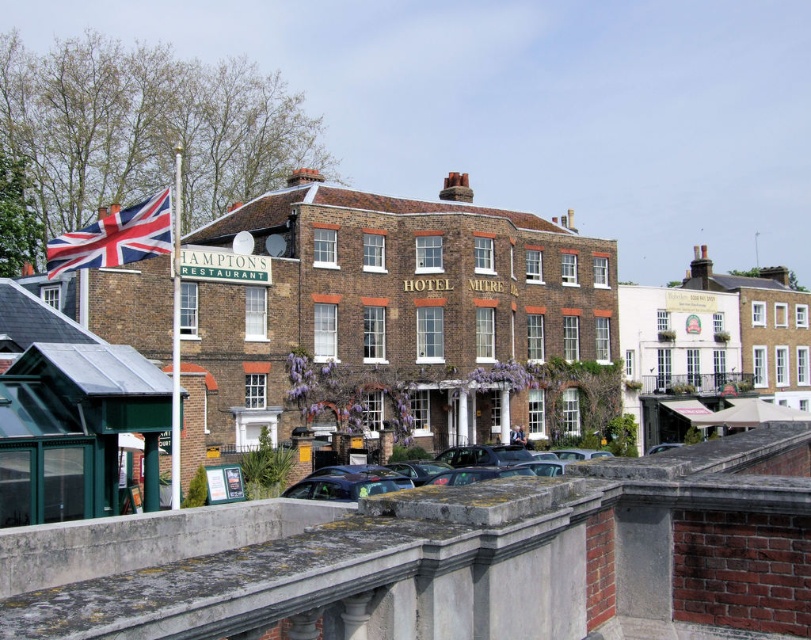
Question: Which object appears farthest from the camera in this image?

Choices:
 (A) union jack fabric at upper left
 (B) white painted building at upper right
 (C) metallic gray car at center
 (D) white brick building at upper right

Answer: (D)

Question: Which of the following is the farthest from the observer?

Choices:
 (A) metallic gray car at center
 (B) white brick building at upper right
 (C) white painted building at upper right

Answer: (B)

Question: Estimate the real-world distances between objects in this image. Which object is farther from the white painted building at upper right?

Choices:
 (A) metallic gray car at center
 (B) union jack fabric at upper left
 (C) white brick building at upper right

Answer: (B)

Question: Does white painted building at upper right appear under metallic gray car at center?

Choices:
 (A) no
 (B) yes

Answer: (A)

Question: Does white painted building at upper right have a larger size compared to metallic gray car at center?

Choices:
 (A) no
 (B) yes

Answer: (B)

Question: In this image, where is union jack fabric at upper left located relative to metallic gray car at center?

Choices:
 (A) left
 (B) right

Answer: (A)